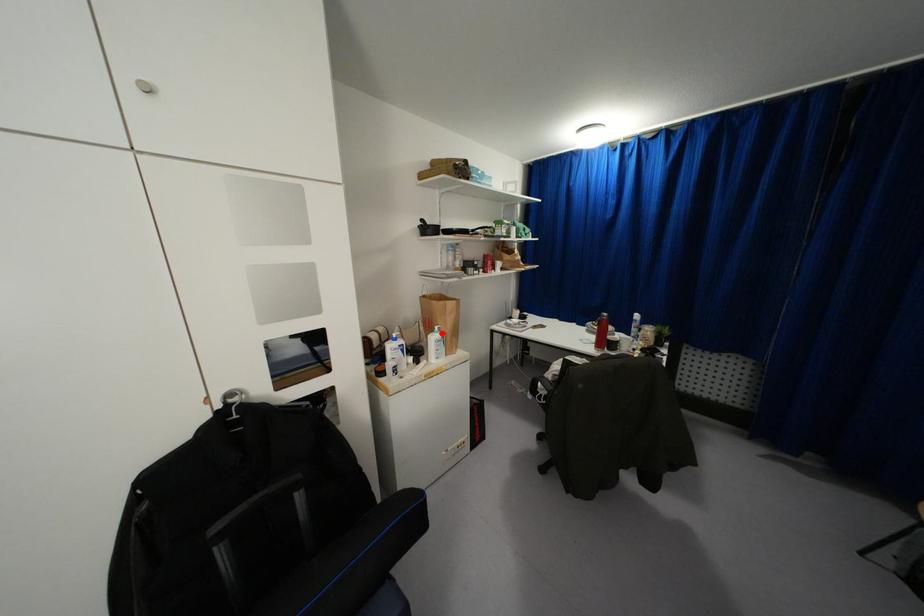
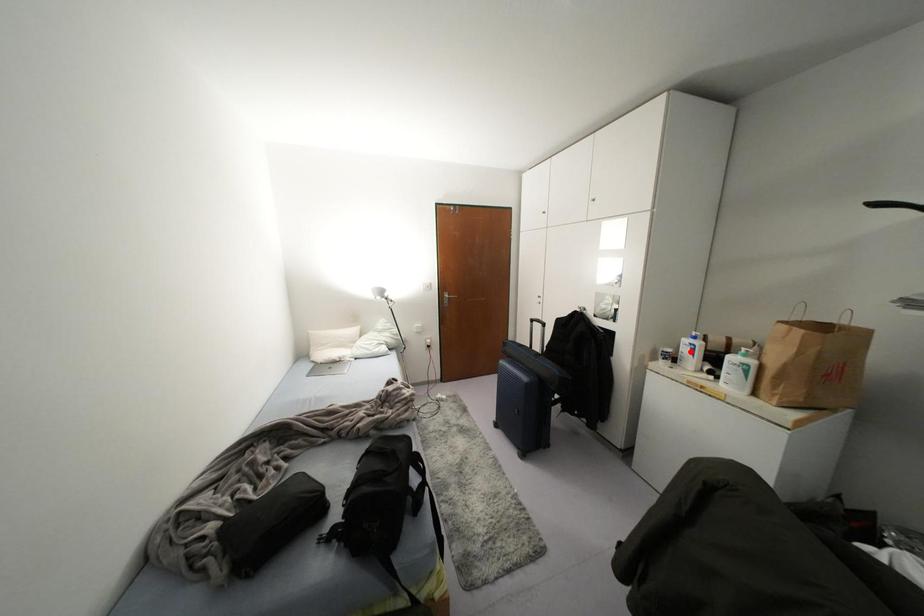
I am providing you with two images of the same scene from different viewpoints. A red point is marked on the first image and another point is marked on the second image. Is the red point in image1 aligned with the point shown in image2?

No